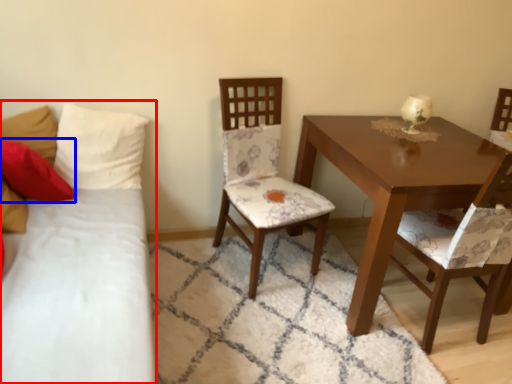
Question: Which of the following is the farthest to the observer, studio couch (highlighted by a red box) or pillow (highlighted by a blue box)?

Choices:
 (A) studio couch
 (B) pillow

Answer: (B)